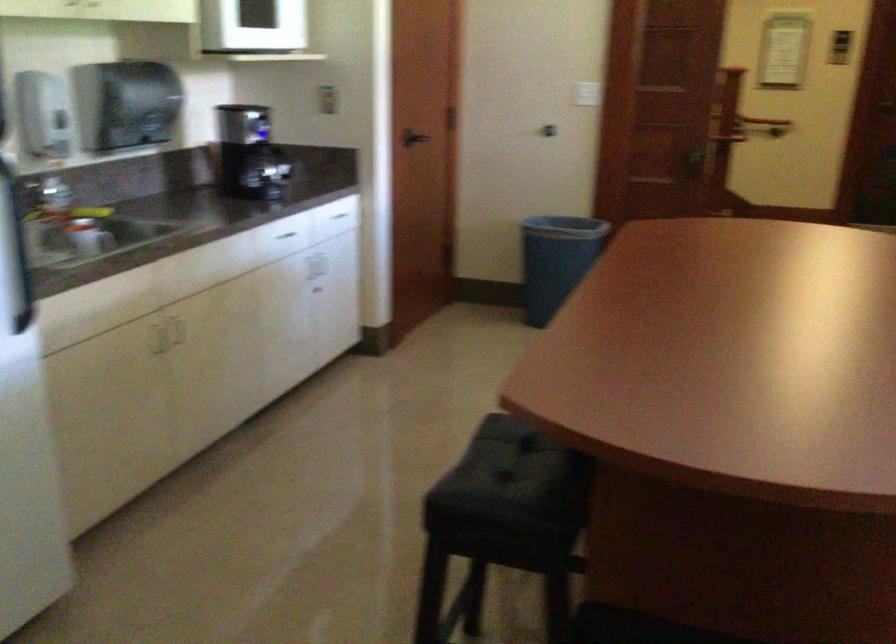
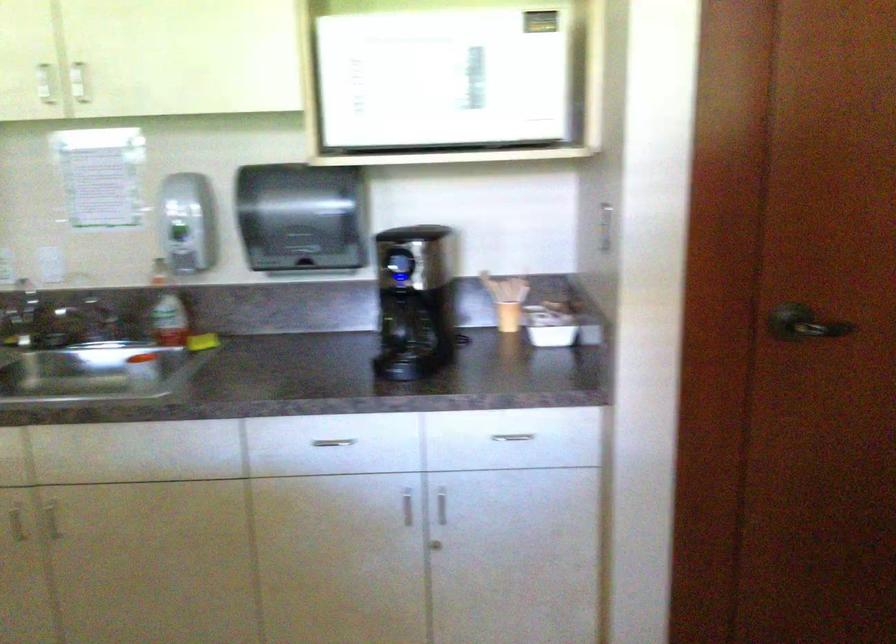
The point at (277, 241) is marked in the first image. Where is the corresponding point in the second image?

(332, 442)